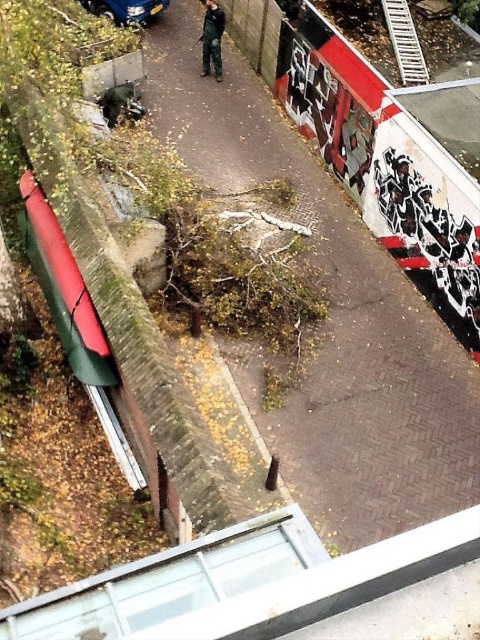
Does metallic blue car at upper left have a greater width compared to dark green camouflage pants at center?

Yes.

Measure the distance between metallic blue car at upper left and dark green camouflage pants at center.

metallic blue car at upper left is 3.09 meters away from dark green camouflage pants at center.

Which is in front, point (143, 1) or point (219, 58)?

Positioned in front is point (219, 58).

Identify the location of metallic blue car at upper left. (127, 10).